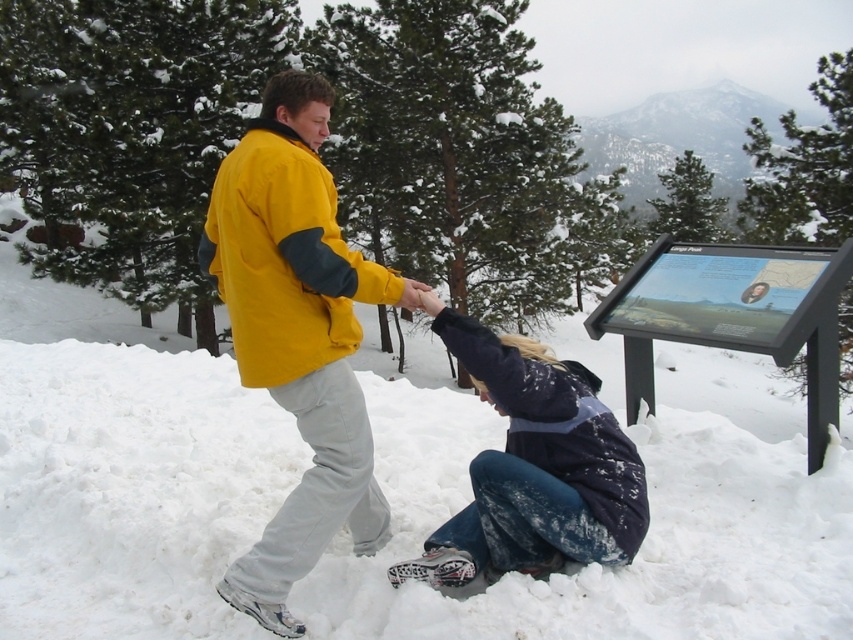
Can you confirm if dark blue denim jeans at lower center is positioned above yellow fleece jacket at upper center?

Incorrect, dark blue denim jeans at lower center is not positioned above yellow fleece jacket at upper center.

Is dark blue denim jeans at lower center closer to the viewer compared to yellow fleece jacket at upper center?

No.

At what (x,y) coordinates should I click in order to perform the action: click on dark blue denim jeans at lower center. Please return your answer as a coordinate pair (x, y). Image resolution: width=853 pixels, height=640 pixels. Looking at the image, I should click on (534, 467).

Locate an element on the screen. This screenshot has height=640, width=853. dark blue denim jeans at lower center is located at coordinates (534, 467).

Does white fluffy snow at lower center have a greater width compared to yellow fleece jacket at center?

Correct, the width of white fluffy snow at lower center exceeds that of yellow fleece jacket at center.

Does white fluffy snow at lower center have a smaller size compared to yellow fleece jacket at center?

Correct, white fluffy snow at lower center occupies less space than yellow fleece jacket at center.

Is point (88, 588) positioned behind point (360, 548)?

Yes, it is.

Where is `white fluffy snow at lower center`? Image resolution: width=853 pixels, height=640 pixels. white fluffy snow at lower center is located at coordinates tap(595, 564).

From the picture: Is yellow fleece jacket at center wider than yellow fleece jacket at upper center?

Yes, yellow fleece jacket at center is wider than yellow fleece jacket at upper center.

Is yellow fleece jacket at center smaller than yellow fleece jacket at upper center?

No, yellow fleece jacket at center is not smaller than yellow fleece jacket at upper center.

Is point (392, 298) positioned behind point (280, 253)?

Yes, point (392, 298) is behind point (280, 253).

The image size is (853, 640). In order to click on yellow fleece jacket at center in this screenshot , I will do `click(297, 333)`.